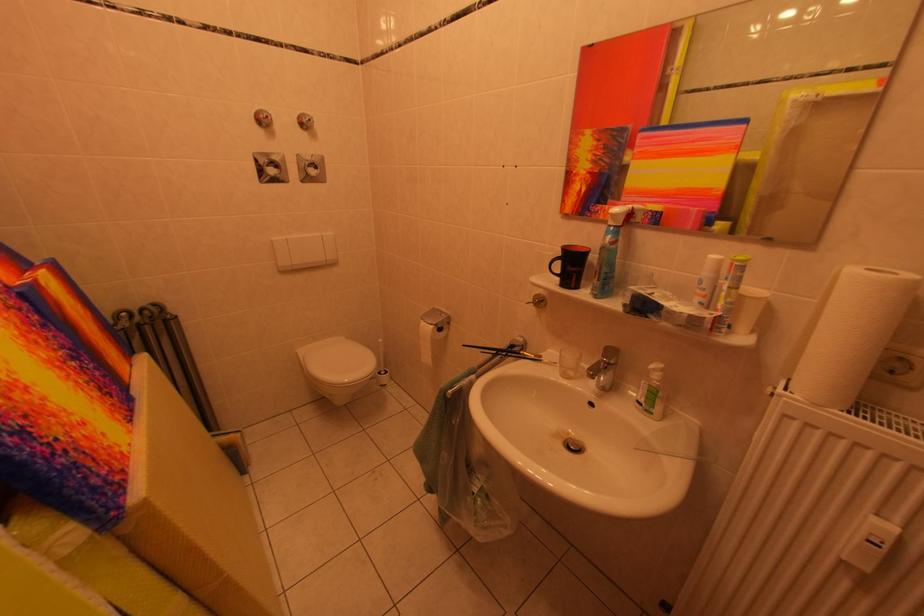
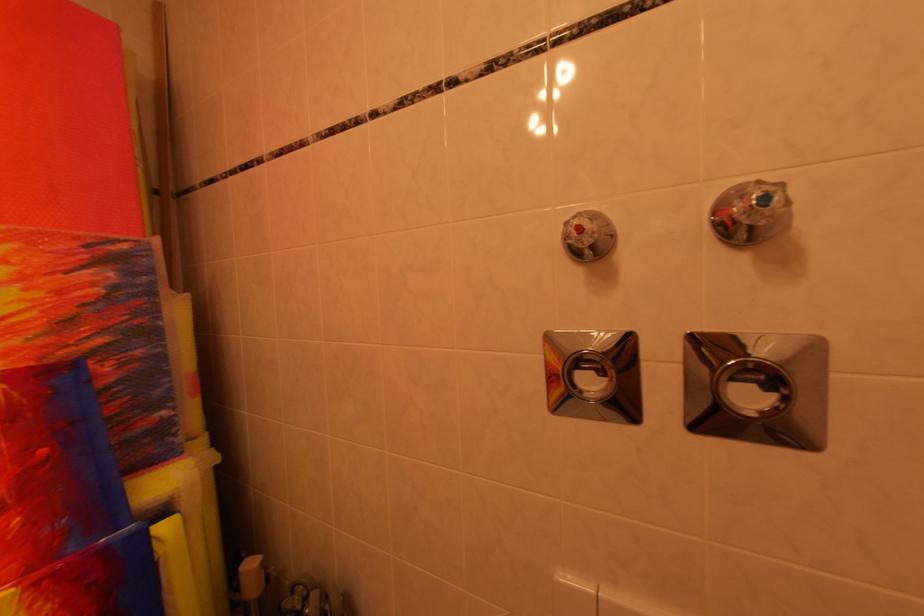
Where in the second image is the point corresponding to the point at 320,123 from the first image?

(773, 201)